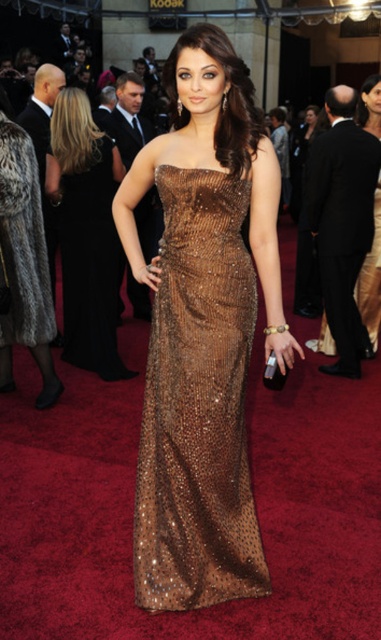
Is shiny bronze gown at center positioned before shiny black suit at center?

Yes, shiny bronze gown at center is closer to the viewer.

Who is more forward, (153, 582) or (308, 212)?

Point (153, 582)

Locate an element on the screen. shiny bronze gown at center is located at coordinates (198, 404).

Is shiny black suit at center positioned before shiny metallic dress at center?

No, shiny black suit at center is further to the viewer.

From the picture: Is shiny black suit at center further to the viewer compared to shiny metallic dress at center?

Yes, it is.

Locate an element on the screen. shiny black suit at center is located at coordinates (342, 224).

Who is taller, shiny bronze dress at center or shiny metallic dress at center?

shiny bronze dress at center is taller.

Does point (97, 225) come in front of point (40, 342)?

No, (97, 225) is further to viewer.

The image size is (381, 640). In order to click on shiny bronze dress at center in this screenshot , I will do `click(86, 234)`.